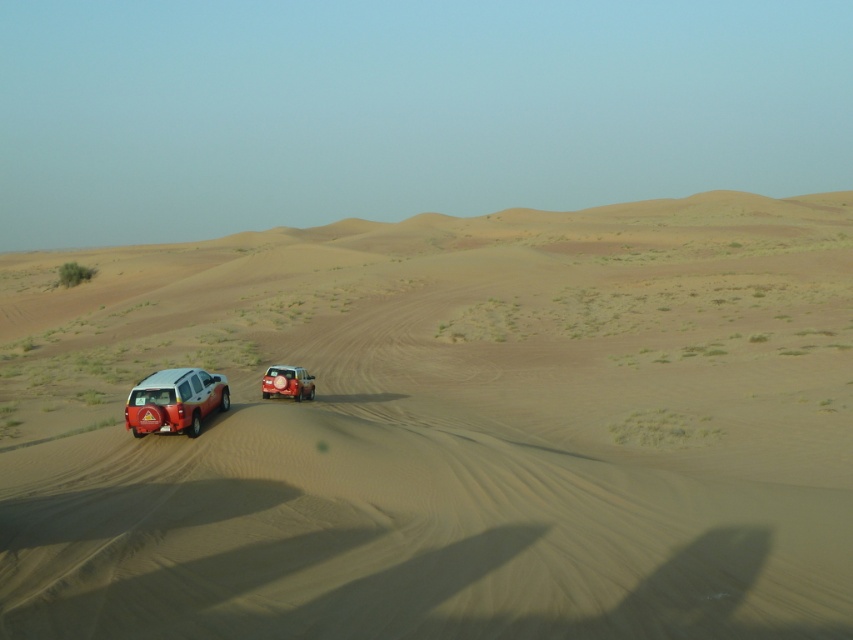
How much distance is there between sandy beige dunes at center and matte white suv at lower left?

A distance of 83.22 meters exists between sandy beige dunes at center and matte white suv at lower left.

Does sandy beige dunes at center appear under matte white suv at lower left?

Incorrect, sandy beige dunes at center is not positioned below matte white suv at lower left.

Identify the location of sandy beige dunes at center. (444, 429).

Is the position of sandy beige dunes at center less distant than that of metallic silver suv at center?

Yes, sandy beige dunes at center is in front of metallic silver suv at center.

Between sandy beige dunes at center and metallic silver suv at center, which one has less height?

metallic silver suv at center is shorter.

Where is `sandy beige dunes at center`? The height and width of the screenshot is (640, 853). sandy beige dunes at center is located at coordinates (444, 429).

Is matte white suv at lower left behind metallic silver suv at center?

No.

Is matte white suv at lower left above metallic silver suv at center?

No, matte white suv at lower left is not above metallic silver suv at center.

Locate an element on the screen. The image size is (853, 640). matte white suv at lower left is located at coordinates coord(173,401).

This screenshot has height=640, width=853. In order to click on matte white suv at lower left in this screenshot , I will do `click(173, 401)`.